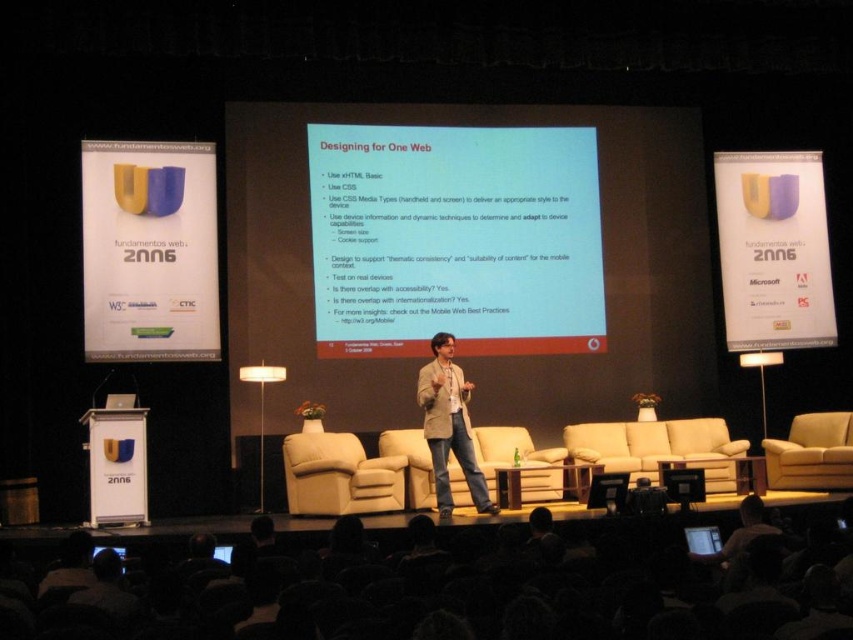
Who is taller, light beige leather couch at center or matte black screen at center?

light beige leather couch at center is taller.

The height and width of the screenshot is (640, 853). What are the coordinates of `light beige leather couch at center` in the screenshot? It's located at (445, 582).

Which is behind, point (817, 573) or point (692, 538)?

The point (692, 538) is behind.

I want to click on light beige leather couch at center, so click(445, 582).

Is white paper at center positioned behind matte black screen at center?

Yes.

Does white paper at center appear on the left side of matte black screen at center?

Correct, you'll find white paper at center to the left of matte black screen at center.

You are a GUI agent. You are given a task and a screenshot of the screen. Output one action in this format:
    pyautogui.click(x=<x>, y=<y>)
    Task: Click on the white paper at center
    The image size is (853, 640).
    Given the screenshot: What is the action you would take?
    pyautogui.click(x=456, y=240)

Can you confirm if light beige leather armchair at center is positioned above matte black laptop at lower left?

Correct, light beige leather armchair at center is located above matte black laptop at lower left.

Does light beige leather armchair at center have a smaller size compared to matte black laptop at lower left?

Correct, light beige leather armchair at center occupies less space than matte black laptop at lower left.

Which is behind, point (325, 513) or point (100, 550)?

The point (325, 513) is more distant.

Where is `light beige leather armchair at center`? light beige leather armchair at center is located at coordinates (339, 476).